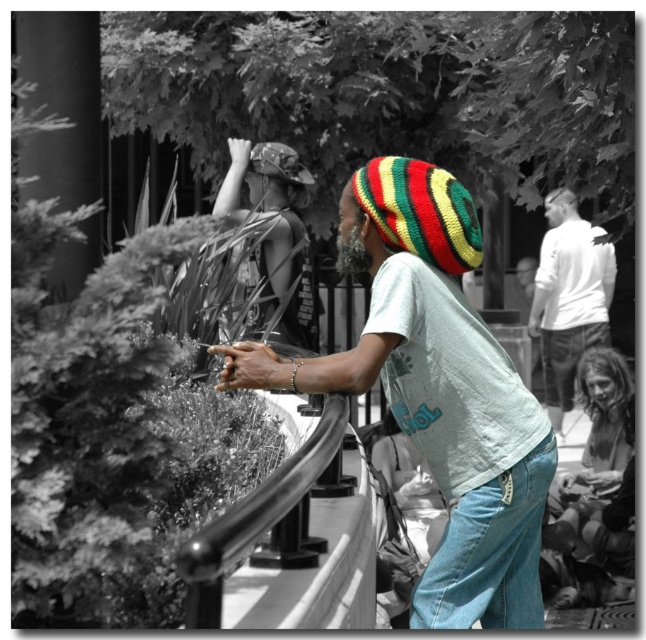
You are a photographer trying to capture the knitted multicolored hat at center and the white cotton shirt at upper right in the same frame. Based on their positions, which object should you focus on first to ensure both are in the frame?

The knitted multicolored hat at center is located below the white cotton shirt at upper right, so you should focus on the white cotton shirt at upper right first to ensure both are in the frame.

You are a fashion designer observing a street scene. You notice the knitted multicolored hat at center and the white cotton shirt at upper right. Which item appears shorter in height?

The knitted multicolored hat at center has a lesser height compared to the white cotton shirt at upper right, so the knitted multicolored hat at center appears shorter in height.

You are standing at the metal railing in the foreground of the street scene. You notice two points marked in the image. The first point is at coordinate point (370,248) and the second is at coordinate point (578,227). Which point is closer to you?

Point (370,248) is in front of point (578,227), so the first point is closer to you.